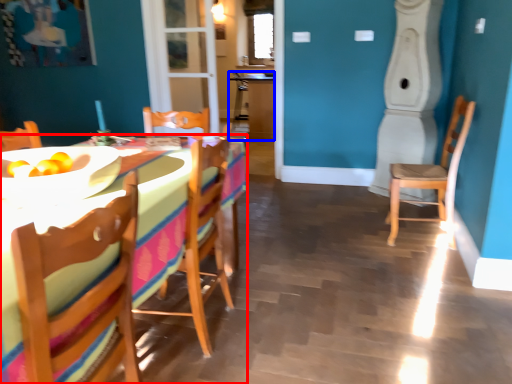
Question: Among these objects, which one is nearest to the camera, desk (highlighted by a red box) or table (highlighted by a blue box)?

Choices:
 (A) desk
 (B) table

Answer: (A)